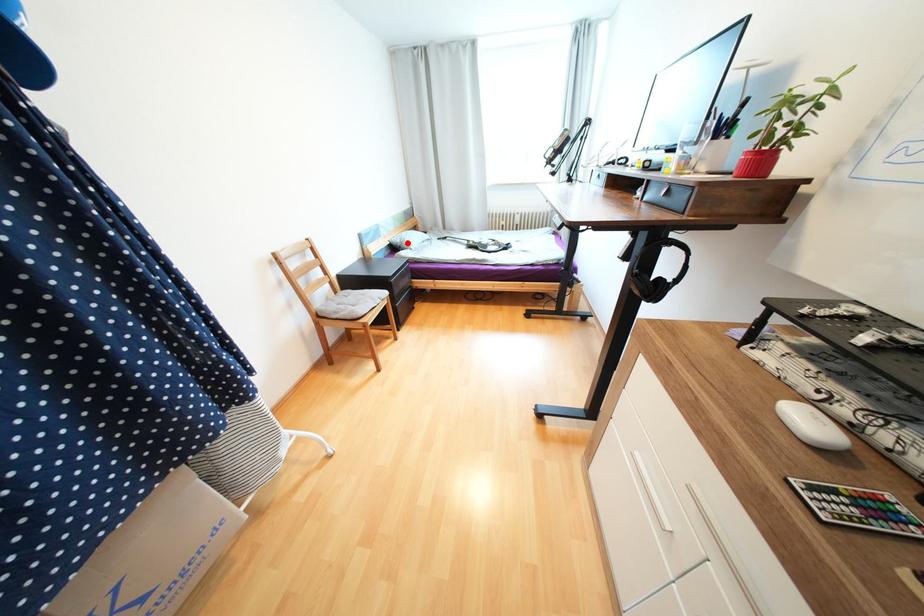
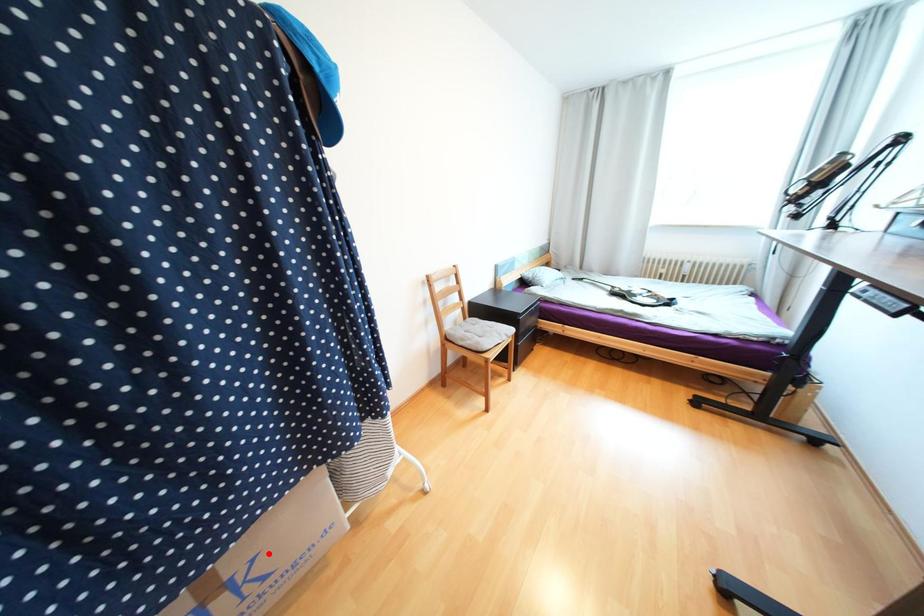
I am providing you with two images of the same scene from different viewpoints. A red point is marked on the first image and another point is marked on the second image. Does the point marked in image1 correspond to the same location as the one in image2?

No